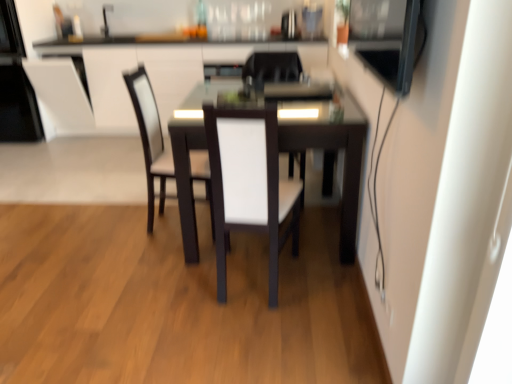
I want to click on vacant space in front of dark wood table at center, so click(241, 317).